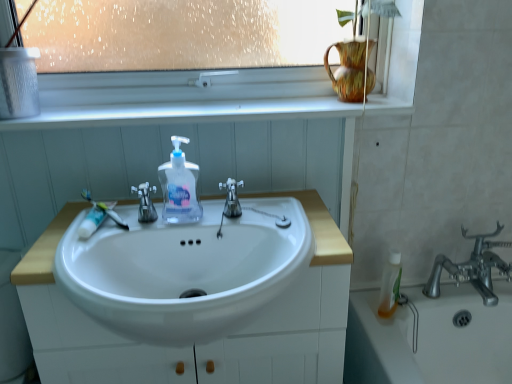
Image resolution: width=512 pixels, height=384 pixels. Identify the location of blank space to the left of satin nickel faucet at center, arranged as the second tap when viewed from the right. (77, 238).